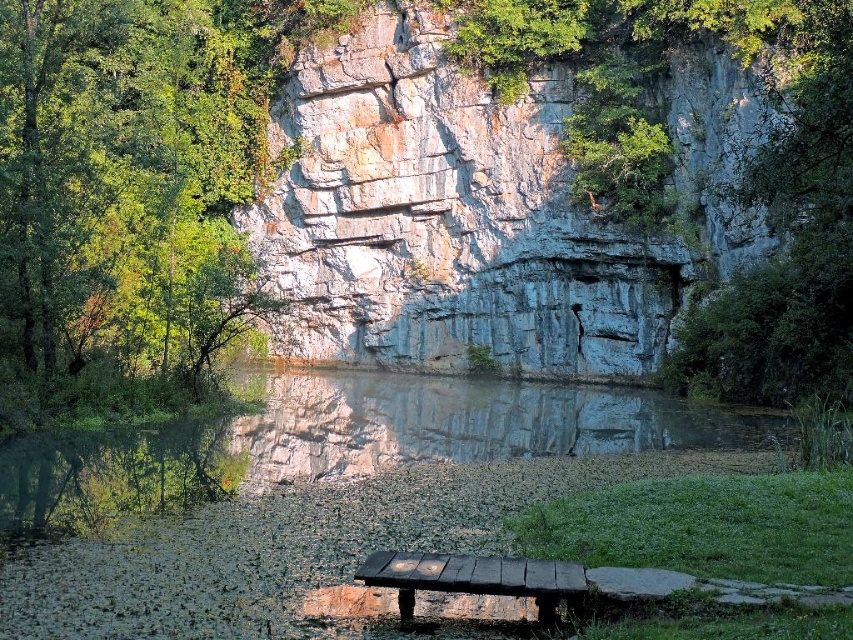
Based on the photo, you are an artist planning to sketch this scene. You want to ensure the green leafy tree at upper left and the charcoal wood bench at lower center are proportionally accurate. Which object should you draw larger in your sketch?

The green leafy tree at upper left should be drawn larger than the charcoal wood bench at lower center because it is bigger in size according to the description.

You are standing at the water edge in the scene. There are two points marked in the image. The first point is at coordinates point (x=84, y=292) and the second is at point (x=508, y=584). Which point is closer to you?

Point (x=508, y=584) is closer to you because point (x=84, y=292) is behind it.

You are standing at the base of the cliff and want to rest on the charcoal wood bench at lower center while still having a view of the green leafy tree at upper left. Is the tree visible from the bench?

The green leafy tree at upper left is taller than the charcoal wood bench at lower center, so yes, the tree will be visible from the bench as it is taller and likely extends above the bench.